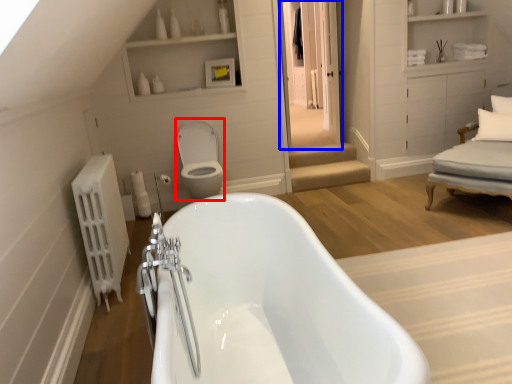
Question: Which object appears closest to the camera in this image, toilet bowl (highlighted by a red box) or glass door (highlighted by a blue box)?

Choices:
 (A) toilet bowl
 (B) glass door

Answer: (A)